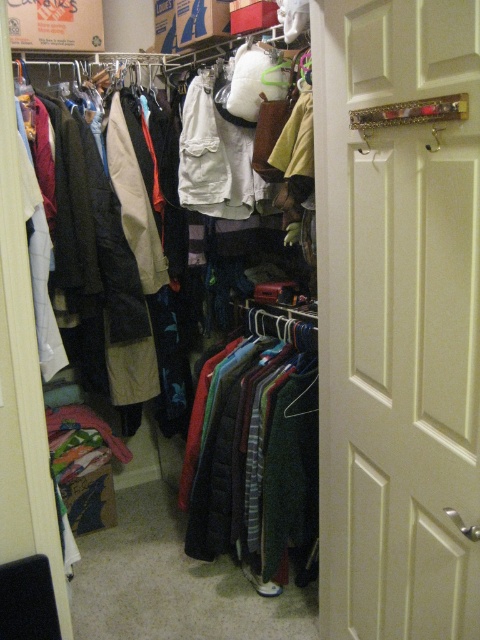
Question: Can you confirm if matte black coat at upper left is wider than dark green wool sweater at center?

Choices:
 (A) no
 (B) yes

Answer: (B)

Question: Which is nearer to the dark green wool sweater at center?

Choices:
 (A) white wood door at center
 (B) matte black coat at upper left

Answer: (A)

Question: Which object appears closest to the camera in this image?

Choices:
 (A) white wood door at center
 (B) matte black coat at upper left

Answer: (A)

Question: Which object is the farthest from the dark green wool sweater at center?

Choices:
 (A) matte black coat at upper left
 (B) white wood door at center

Answer: (A)

Question: Where is matte black coat at upper left located in relation to dark green wool sweater at center in the image?

Choices:
 (A) left
 (B) right

Answer: (A)

Question: In this image, where is white wood door at center located relative to dark green wool sweater at center?

Choices:
 (A) below
 (B) above

Answer: (B)